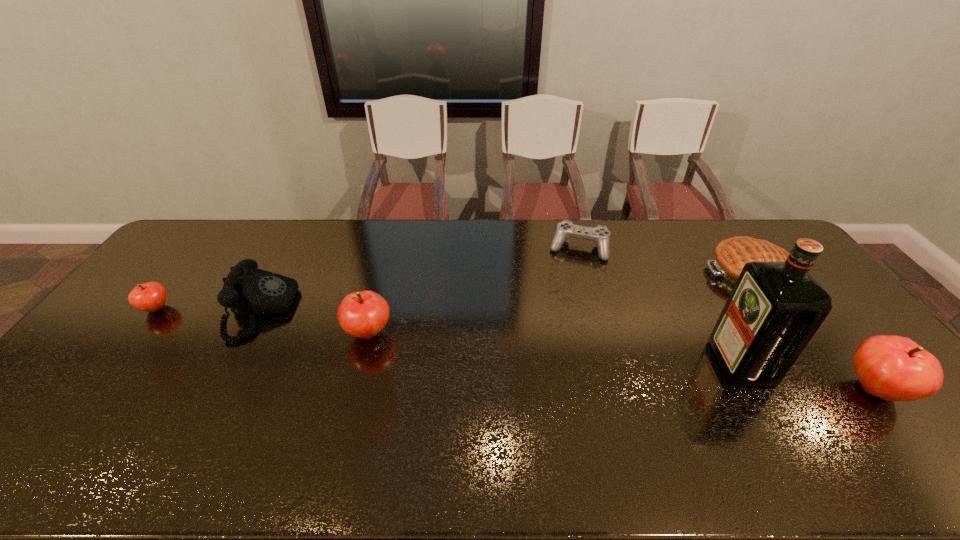
This screenshot has height=540, width=960. In order to click on telephone in this screenshot , I will do `click(247, 290)`.

Find the location of a particular element. free space located on the right of the leftmost object is located at coordinates 218,308.

Identify the location of free space located 0.130m on the back of the third object from left to right. The width and height of the screenshot is (960, 540). (380, 286).

Find the location of a particular element. vacant area situated 0.380m on the back of the nearest apple is located at coordinates (782, 272).

Where is `free space located 0.080m on the left of the control`? The width and height of the screenshot is (960, 540). free space located 0.080m on the left of the control is located at coordinates (527, 248).

Locate an element on the screen. free space located 0.160m on the back of the pie is located at coordinates (715, 224).

Where is `vacant region located on the front label of the liquor`? The image size is (960, 540). vacant region located on the front label of the liquor is located at coordinates (647, 363).

Identify the location of vacant space located 0.090m on the front label of the liquor. This screenshot has width=960, height=540. (684, 363).

Image resolution: width=960 pixels, height=540 pixels. I want to click on free space located 0.380m on the front label of the liquor, so click(577, 363).

Locate an element on the screen. This screenshot has width=960, height=540. free space located 0.300m on the dial of the telephone is located at coordinates tap(389, 310).